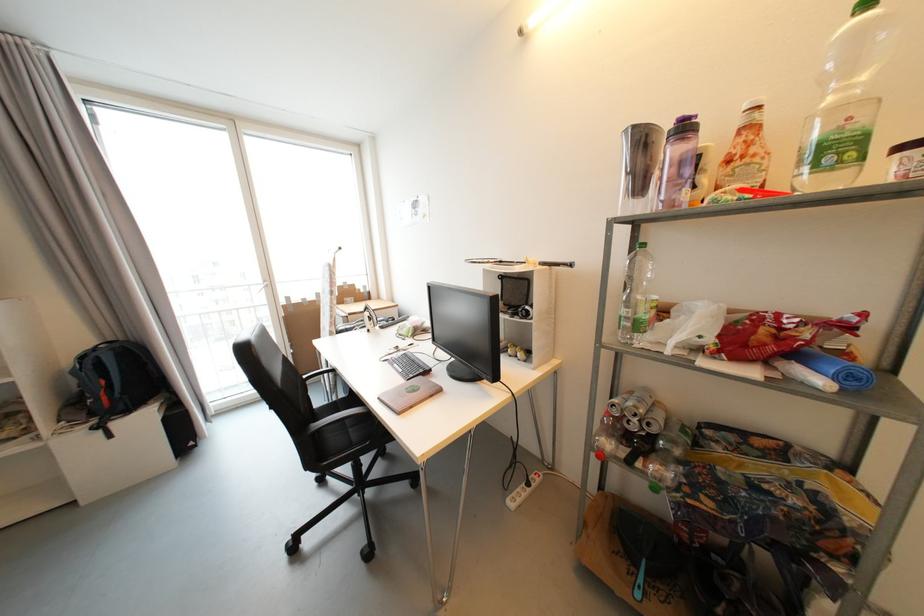
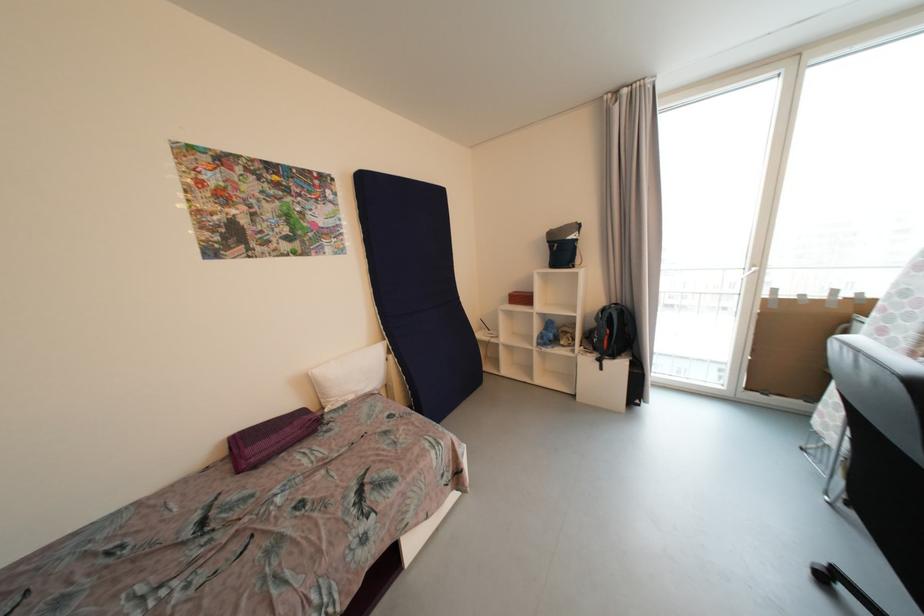
Find the pixel in the second image that matches (89,359) in the first image.

(608, 312)